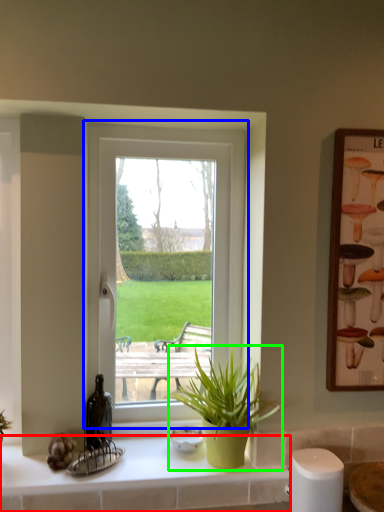
Question: Considering the real-world distances, which object is closest to counter top (highlighted by a red box)? window (highlighted by a blue box) or houseplant (highlighted by a green box).

Choices:
 (A) window
 (B) houseplant

Answer: (B)